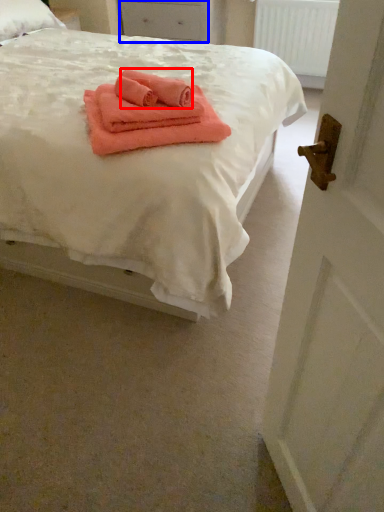
Question: Which point is further to the camera, cloth (highlighted by a red box) or drawer (highlighted by a blue box)?

Choices:
 (A) cloth
 (B) drawer

Answer: (B)